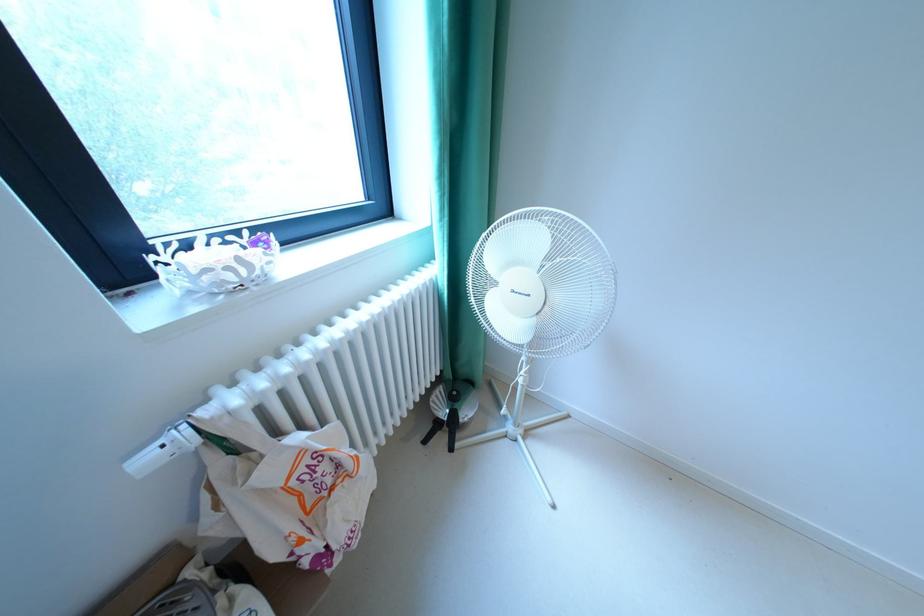
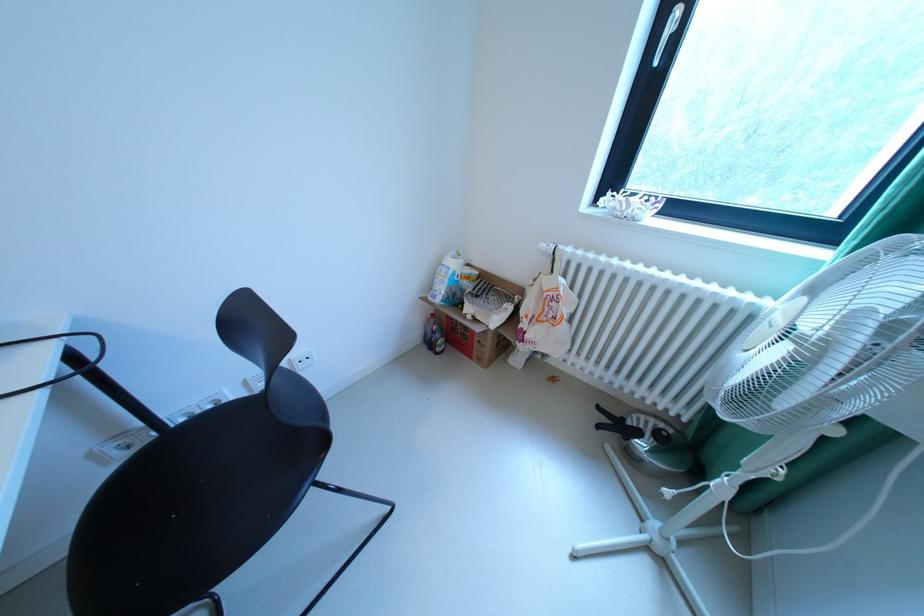
The point at (156, 460) is marked in the first image. Where is the corresponding point in the second image?

(553, 246)